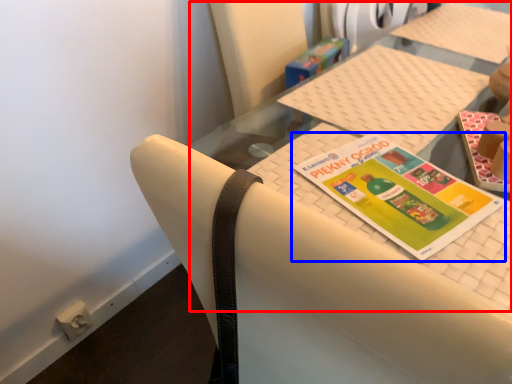
Question: Which of the following is the closest to the observer, tablecloth (highlighted by a red box) or book (highlighted by a blue box)?

Choices:
 (A) tablecloth
 (B) book

Answer: (A)